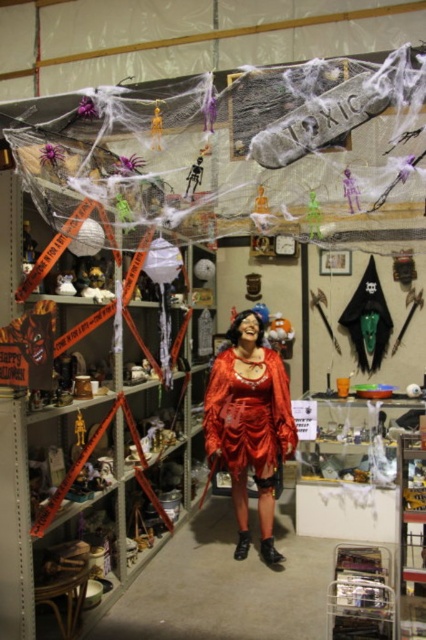
You are a customer in a Halloween store and see the orange paper banner at left and the shiny red dress at center. Which item is located to the left of the other?

The orange paper banner at left is positioned on the left side of shiny red dress at center.